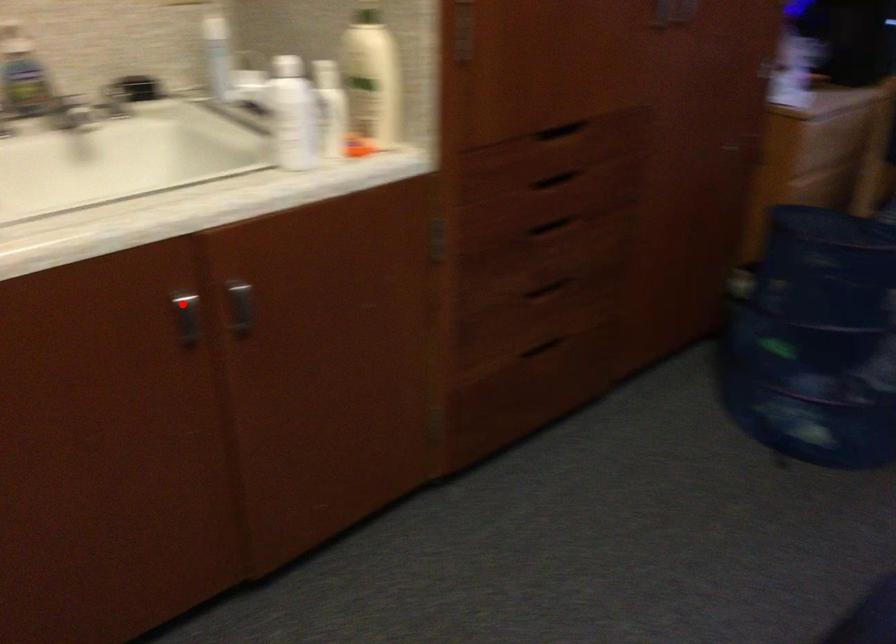
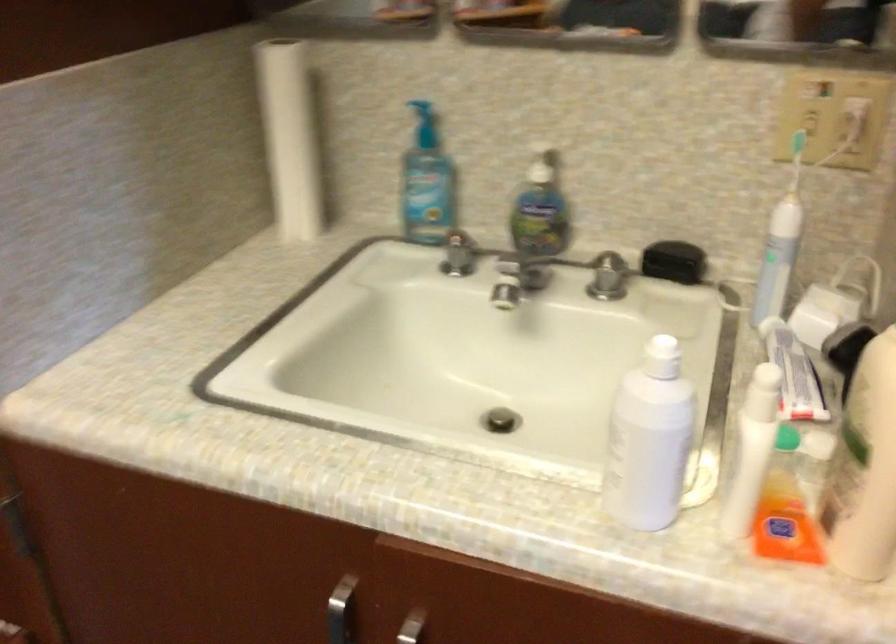
Question: I am providing you with two images of the same scene from different viewpoints. Image1 has a red point marked. In image2, the corresponding 3D location appears at what relative position? Reply with the corresponding letter.

Choices:
 (A) Closer
 (B) Farther

Answer: (A)